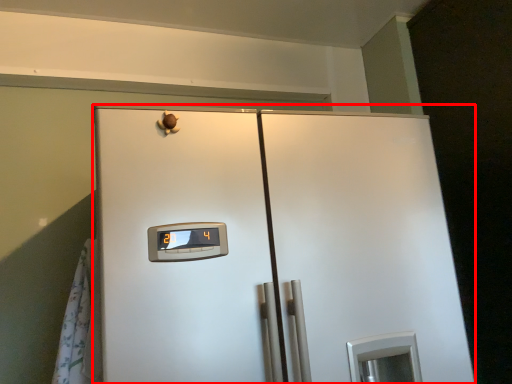
Question: Where is refrigerator (annotated by the red box) located in relation to curtain in the image?

Choices:
 (A) left
 (B) right

Answer: (B)